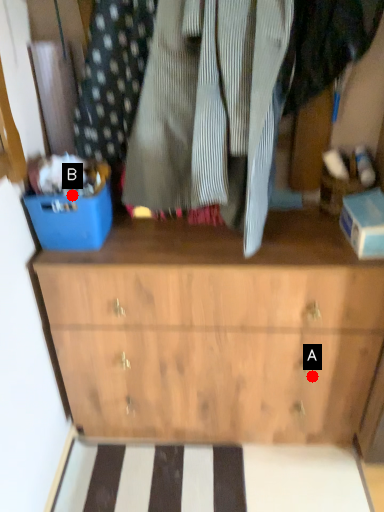
Question: Two points are circled on the image, labeled by A and B beside each circle. Which point appears closest to the camera in this image?

Choices:
 (A) A is closer
 (B) B is closer

Answer: (B)